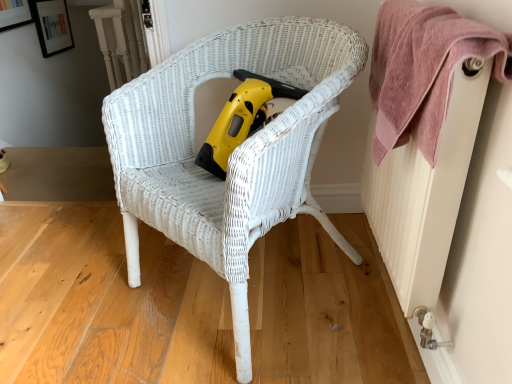
Question: Which is correct: yellow plastic vacuum at center is inside white wicker chair at center, or outside of it?

Choices:
 (A) outside
 (B) inside

Answer: (B)

Question: In the image, is yellow plastic vacuum at center positioned in front of or behind white wicker chair at center?

Choices:
 (A) behind
 (B) front

Answer: (A)

Question: Which object is positioned closest to the yellow plastic vacuum at center?

Choices:
 (A) white textured radiator at right
 (B) white wicker chair at center
 (C) pink textured towel at upper right

Answer: (B)

Question: Estimate the real-world distances between objects in this image. Which object is closer to the yellow plastic vacuum at center?

Choices:
 (A) pink textured towel at upper right
 (B) white wicker chair at center
 (C) white textured radiator at right

Answer: (B)